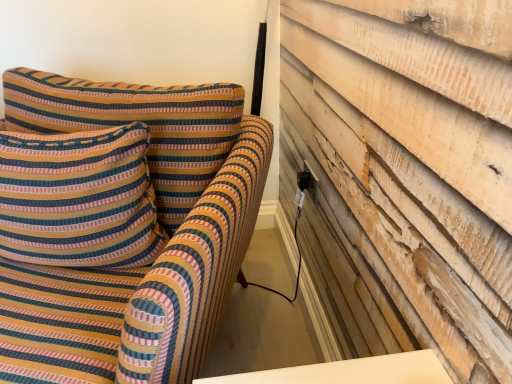
Identify the location of striped fabric sofa at left. (121, 225).

What do you see at coordinates (79, 199) in the screenshot? I see `striped fabric pillow at upper left` at bounding box center [79, 199].

Locate an element on the screen. The width and height of the screenshot is (512, 384). black plastic electric outlet at upper right is located at coordinates click(307, 181).

Is striped fabric pillow at upper left in front of or behind black plastic electric outlet at upper right in the image?

Visually, striped fabric pillow at upper left is located in front of black plastic electric outlet at upper right.

Is striped fabric pillow at upper left taller than black plastic electric outlet at upper right?

Yes.

From the image's perspective, is striped fabric sofa at left positioned above or below striped fabric pillow at upper left?

Clearly, from the image's perspective, striped fabric sofa at left is below striped fabric pillow at upper left.

Is striped fabric sofa at left to the left of striped fabric pillow at upper left from the viewer's perspective?

No.

How many degrees apart are the facing directions of striped fabric sofa at left and striped fabric pillow at upper left?

The facing directions of striped fabric sofa at left and striped fabric pillow at upper left are 13.8 degrees apart.

Is striped fabric pillow at upper left surrounded by striped fabric sofa at left?

Yes, striped fabric sofa at left is surrounding striped fabric pillow at upper left.

How far apart are black plastic electric outlet at upper right and striped fabric pillow at upper left?

The distance of black plastic electric outlet at upper right from striped fabric pillow at upper left is 24.03 inches.

Considering the positions of point (297, 181) and point (36, 157), is point (297, 181) closer or farther from the camera than point (36, 157)?

Point (297, 181).

From the image's perspective, is black plastic electric outlet at upper right above or below striped fabric pillow at upper left?

black plastic electric outlet at upper right is above striped fabric pillow at upper left.

Which of these two, black plastic electric outlet at upper right or striped fabric pillow at upper left, is thinner?

black plastic electric outlet at upper right is thinner.

Does point (303, 180) lie in front of point (101, 106)?

No, (303, 180) is further to viewer.

Is black plastic electric outlet at upper right situated inside striped fabric sofa at left or outside?

black plastic electric outlet at upper right is not enclosed by striped fabric sofa at left.

Locate an element on the screen. The image size is (512, 384). electric outlet on the right of striped fabric sofa at left is located at coordinates (307, 181).

Would you say black plastic electric outlet at upper right is to the left or to the right of striped fabric sofa at left in the picture?

black plastic electric outlet at upper right is positioned on striped fabric sofa at left's right side.

The image size is (512, 384). What are the coordinates of `electric outlet that appears above the striped fabric sofa at left (from the image's perspective)` in the screenshot? It's located at (307, 181).

Can you confirm if striped fabric sofa at left is positioned to the right of black plastic electric outlet at upper right?

No.

Between striped fabric sofa at left and black plastic electric outlet at upper right, which one has smaller size?

With smaller size is black plastic electric outlet at upper right.

Does striped fabric sofa at left have a lesser height compared to black plastic electric outlet at upper right?

No.

From a real-world perspective, between striped fabric pillow at upper left and striped fabric sofa at left, who is vertically higher?

In real-world perspective, striped fabric pillow at upper left is above.

Is striped fabric pillow at upper left aimed at striped fabric sofa at left?

Yes, striped fabric pillow at upper left is oriented towards striped fabric sofa at left.

Between striped fabric pillow at upper left and striped fabric sofa at left, which one appears on the right side from the viewer's perspective?

Positioned to the right is striped fabric sofa at left.

The image size is (512, 384). In order to click on pillow to the left of black plastic electric outlet at upper right in this screenshot , I will do `click(79, 199)`.

Locate an element on the screen. The image size is (512, 384). pillow above the striped fabric sofa at left (from a real-world perspective) is located at coordinates (79, 199).

Looking at the image, which one is located further to striped fabric pillow at upper left, striped fabric sofa at left or black plastic electric outlet at upper right?

Based on the image, black plastic electric outlet at upper right appears to be further to striped fabric pillow at upper left.

Considering their positions, is striped fabric pillow at upper left positioned further to black plastic electric outlet at upper right than striped fabric sofa at left?

striped fabric pillow at upper left is further to black plastic electric outlet at upper right.

When comparing their distances from striped fabric sofa at left, does black plastic electric outlet at upper right or striped fabric pillow at upper left seem further?

black plastic electric outlet at upper right lies further to striped fabric sofa at left than the other object.

Based on their spatial positions, is black plastic electric outlet at upper right or striped fabric sofa at left further from striped fabric pillow at upper left?

Based on the image, black plastic electric outlet at upper right appears to be further to striped fabric pillow at upper left.

From the image, which object appears to be farther from striped fabric sofa at left, striped fabric pillow at upper left or black plastic electric outlet at upper right?

black plastic electric outlet at upper right lies further to striped fabric sofa at left than the other object.

From the image, which object appears to be farther from black plastic electric outlet at upper right, striped fabric sofa at left or striped fabric pillow at upper left?

striped fabric pillow at upper left lies further to black plastic electric outlet at upper right than the other object.

Locate an element on the screen. pillow between striped fabric sofa at left and black plastic electric outlet at upper right along the z-axis is located at coordinates (79, 199).